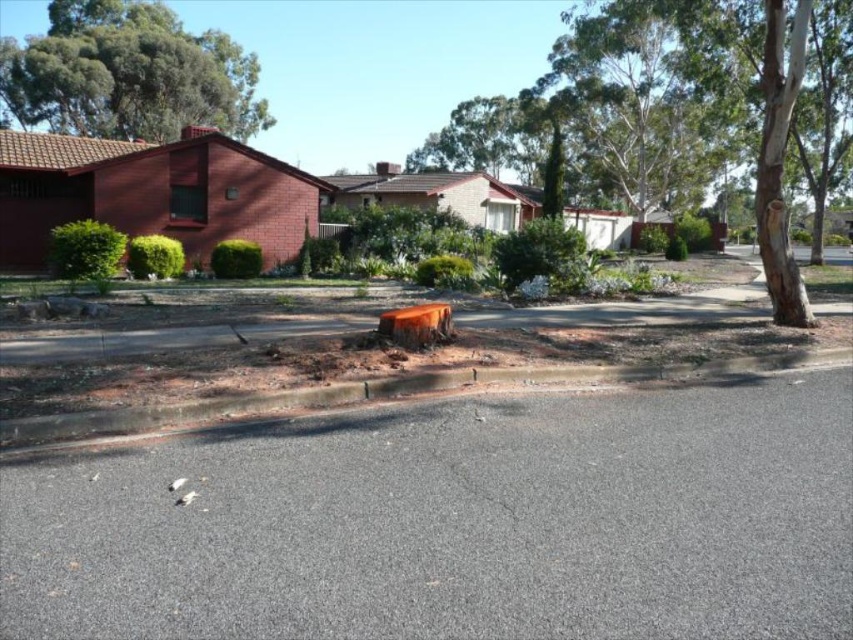
Does smooth bark tree at center have a greater height compared to green leafy tree at upper left?

Yes, smooth bark tree at center is taller than green leafy tree at upper left.

Does point (705, 12) come farther from viewer compared to point (115, 128)?

No, (705, 12) is closer to viewer.

Is point (519, 93) farther from camera compared to point (142, 99)?

Yes, it is behind point (142, 99).

At what (x,y) coordinates should I click in order to perform the action: click on smooth bark tree at center. Please return your answer as a coordinate pair (x, y). Looking at the image, I should click on (682, 112).